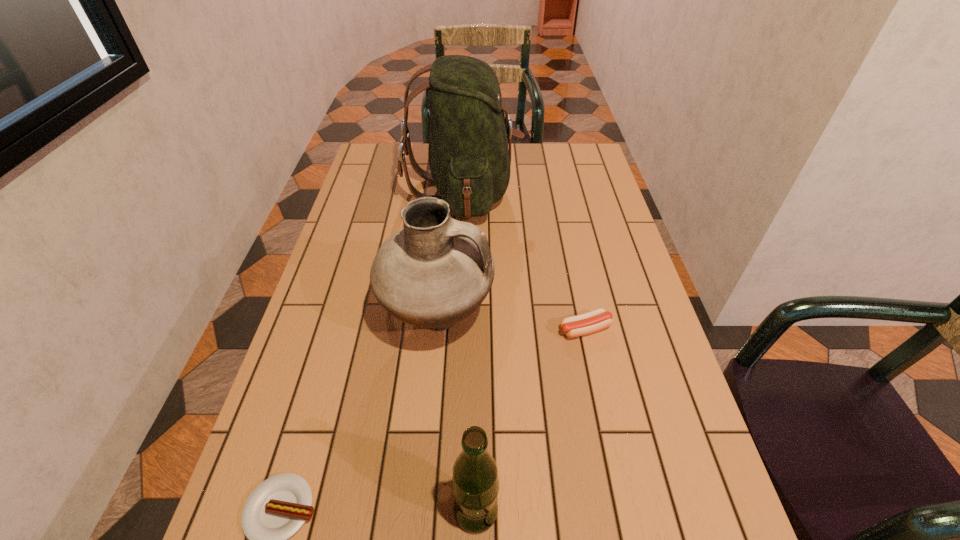
I want to click on object that is at the far edge, so click(x=469, y=160).

This screenshot has width=960, height=540. In order to click on object at the right edge in this screenshot , I will do `click(596, 320)`.

Find the location of `free space at the left edge of the desktop`. free space at the left edge of the desktop is located at coordinates (369, 204).

Where is `vacant area at the right edge of the desktop`? The height and width of the screenshot is (540, 960). vacant area at the right edge of the desktop is located at coordinates (606, 266).

Where is `vacant space at the far left corner of the desktop`? vacant space at the far left corner of the desktop is located at coordinates [375, 170].

Where is `vacant space at the far right corner`? The width and height of the screenshot is (960, 540). vacant space at the far right corner is located at coordinates (566, 167).

The width and height of the screenshot is (960, 540). Find the location of `free point between the third shortest object and the taller sausage`. free point between the third shortest object and the taller sausage is located at coordinates (531, 420).

I want to click on free space that is in between the taller sausage and the fourth shortest object, so click(512, 325).

The width and height of the screenshot is (960, 540). I want to click on vacant space that's between the third shortest object and the pitcher, so (x=457, y=415).

Identify the location of empty location between the third tallest object and the second tallest object. This screenshot has width=960, height=540. (457, 415).